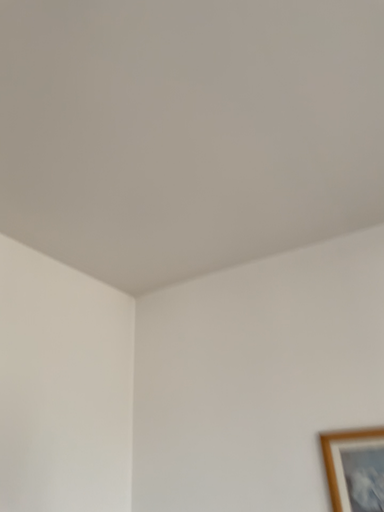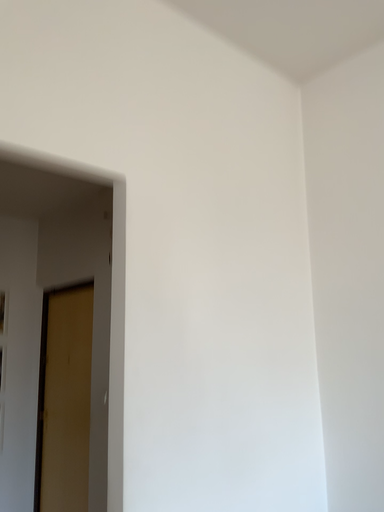
Question: Which way did the camera rotate in the video?

Choices:
 (A) rotated upward
 (B) rotated downward

Answer: (B)